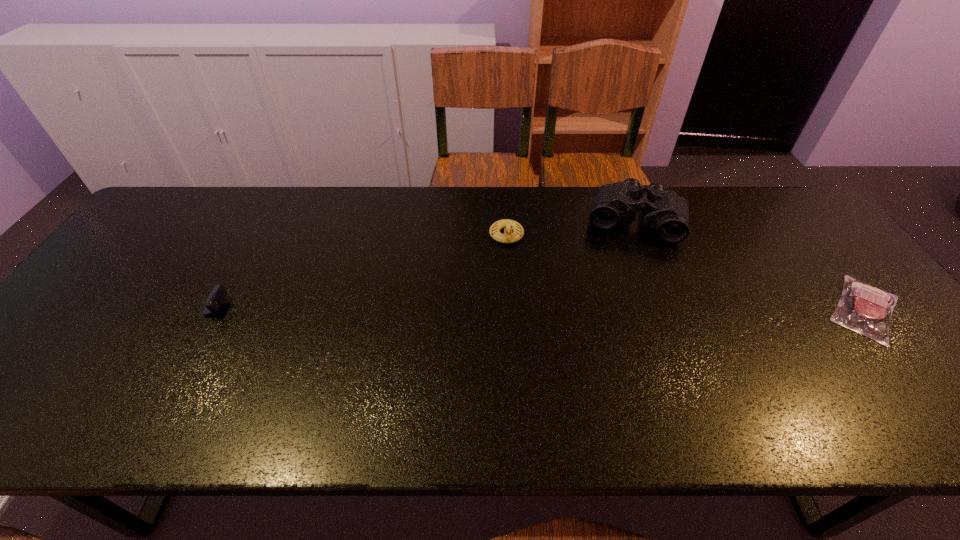
You are a GUI agent. You are given a task and a screenshot of the screen. Output one action in this format:
    pyautogui.click(x=<x>, y=<y>)
    Task: Click on the vacant space located 0.360m on the face of the duckling
    Image resolution: width=960 pixels, height=540 pixels.
    Given the screenshot: What is the action you would take?
    pyautogui.click(x=512, y=352)

Identify the location of vacant area located 0.140m on the face of the duckling. (509, 283).

I want to click on free spot located on the face of the duckling, so click(x=511, y=335).

The width and height of the screenshot is (960, 540). I want to click on vacant area located 0.330m at the eyepieces of the tallest object, so point(615,332).

I want to click on vacant area situated at the eyepieces of the tallest object, so click(x=614, y=338).

Where is `vacant space located 0.350m at the eyepieces of the tallest object`? This screenshot has width=960, height=540. vacant space located 0.350m at the eyepieces of the tallest object is located at coordinates (614, 338).

I want to click on duckling at the far edge, so click(x=508, y=237).

Image resolution: width=960 pixels, height=540 pixels. Identify the location of binoculars that is at the far edge. (665, 211).

At what (x,y) coordinates should I click in order to perform the action: click on object present at the left edge. Please return your answer as a coordinate pair (x, y). This screenshot has width=960, height=540. Looking at the image, I should click on (218, 294).

You are a GUI agent. You are given a task and a screenshot of the screen. Output one action in this format:
    pyautogui.click(x=<x>, y=<y>)
    Task: Click on the object that is positioned at the right edge
    This screenshot has height=540, width=960.
    Given the screenshot: What is the action you would take?
    pyautogui.click(x=863, y=308)